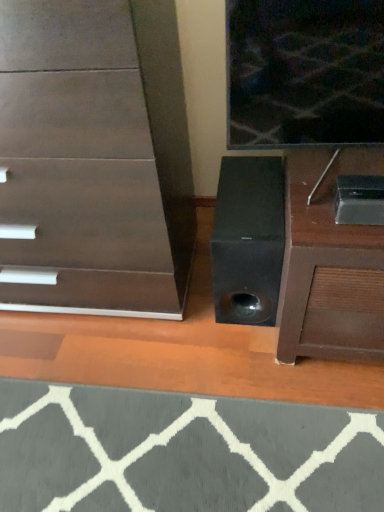
Question: Can you confirm if gray woolen doormat at lower center is bigger than metallic silver speaker at lower right?

Choices:
 (A) no
 (B) yes

Answer: (A)

Question: Does gray woolen doormat at lower center have a greater height compared to metallic silver speaker at lower right?

Choices:
 (A) no
 (B) yes

Answer: (A)

Question: Are gray woolen doormat at lower center and metallic silver speaker at lower right located far from each other?

Choices:
 (A) no
 (B) yes

Answer: (A)

Question: Can you confirm if gray woolen doormat at lower center is smaller than metallic silver speaker at lower right?

Choices:
 (A) no
 (B) yes

Answer: (B)

Question: Does gray woolen doormat at lower center come in front of metallic silver speaker at lower right?

Choices:
 (A) yes
 (B) no

Answer: (A)

Question: Is gray woolen doormat at lower center next to metallic silver speaker at lower right and touching it?

Choices:
 (A) yes
 (B) no

Answer: (B)

Question: Is metallic silver speaker at lower right not inside dark wood chest of drawers at center?

Choices:
 (A) no
 (B) yes

Answer: (B)

Question: From the image's perspective, is metallic silver speaker at lower right located beneath dark wood chest of drawers at center?

Choices:
 (A) no
 (B) yes

Answer: (B)

Question: Is metallic silver speaker at lower right far away from dark wood chest of drawers at center?

Choices:
 (A) yes
 (B) no

Answer: (B)

Question: Does metallic silver speaker at lower right come in front of dark wood chest of drawers at center?

Choices:
 (A) yes
 (B) no

Answer: (B)

Question: Is metallic silver speaker at lower right directly adjacent to dark wood chest of drawers at center?

Choices:
 (A) no
 (B) yes

Answer: (A)

Question: Is metallic silver speaker at lower right at the left side of dark wood chest of drawers at center?

Choices:
 (A) yes
 (B) no

Answer: (B)

Question: Does metallic silver speaker at lower right have a greater width compared to gray woolen doormat at lower center?

Choices:
 (A) no
 (B) yes

Answer: (A)